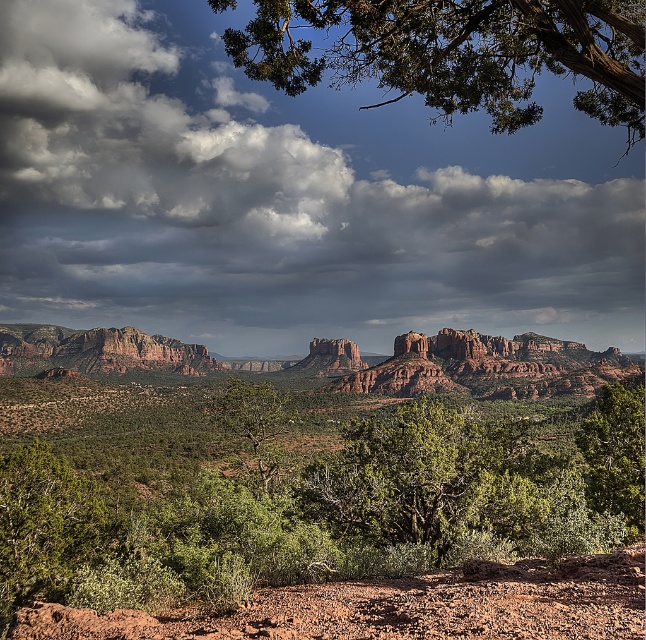
You are standing in the desert landscape and want to take a photo of both the cloudy sky at upper center and the rustic sandstone mountain at left. Which object should you pan your camera towards first to frame them both in the shot?

You should pan your camera towards the rustic sandstone mountain at left first because the cloudy sky at upper center is to the right of it, so adjusting from left to right will allow both objects to be framed together.

You are planning to plant a new tree that requires 100 feet of space between it and any existing vegetation. You have the green leafy shrubs at center and the green leafy tree at center in the image. Can you safely plant the new tree between them without violating the spacing requirement?

The distance between the green leafy shrubs at center and the green leafy tree at center is 87.10 feet. Since the required spacing is 100 feet, planting a new tree between them would not meet the requirement as the existing distance is less than the required 100 feet.

You are an artist planning to paint the scene. You want to ensure the cloudy sky at upper center and the green leafy tree at upper center are proportionate. Which one should you make wider in your painting?

The cloudy sky at upper center should be made wider in the painting since its width is larger than the green leafy tree at upper center according to the description.